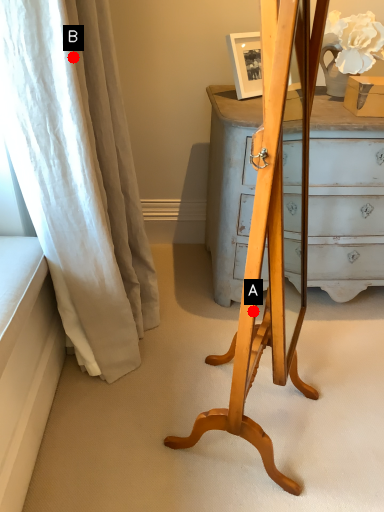
Question: Two points are circled on the image, labeled by A and B beside each circle. Which point is closer to the camera?

Choices:
 (A) A is closer
 (B) B is closer

Answer: (B)